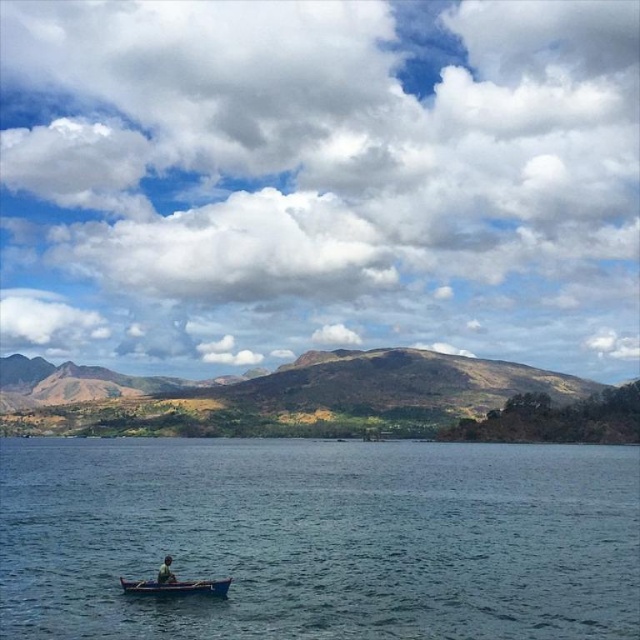
What do you see at coordinates (177, 588) in the screenshot? This screenshot has height=640, width=640. I see `blue wooden canoe at lower center` at bounding box center [177, 588].

Locate an element on the screen. This screenshot has width=640, height=640. blue wooden canoe at lower center is located at coordinates (177, 588).

Image resolution: width=640 pixels, height=640 pixels. Find the location of `blue wooden canoe at lower center`. blue wooden canoe at lower center is located at coordinates (177, 588).

Which of these two, blue water at center or blue wooden canoe at lower center, stands taller?

blue water at center

Does blue water at center appear on the left side of blue wooden canoe at lower center?

Correct, you'll find blue water at center to the left of blue wooden canoe at lower center.

Between point (512, 513) and point (145, 579), which one is positioned behind?

The point (512, 513) is more distant.

At what (x,y) coordinates should I click in order to perform the action: click on blue water at center. Please return your answer as a coordinate pair (x, y). Image resolution: width=640 pixels, height=640 pixels. Looking at the image, I should click on (321, 538).

Can you confirm if blue water at center is positioned to the right of blue fabric person at lower left?

In fact, blue water at center is to the left of blue fabric person at lower left.

Does blue water at center lie in front of blue fabric person at lower left?

Yes, it is in front of blue fabric person at lower left.

Between point (460, 444) and point (163, 561), which one is positioned in front?

Positioned in front is point (163, 561).

Where is `blue water at center`? This screenshot has height=640, width=640. blue water at center is located at coordinates (321, 538).